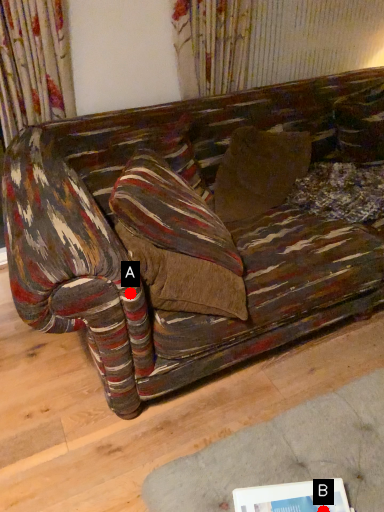
Question: Two points are circled on the image, labeled by A and B beside each circle. Which point appears closest to the camera in this image?

Choices:
 (A) A is closer
 (B) B is closer

Answer: (B)